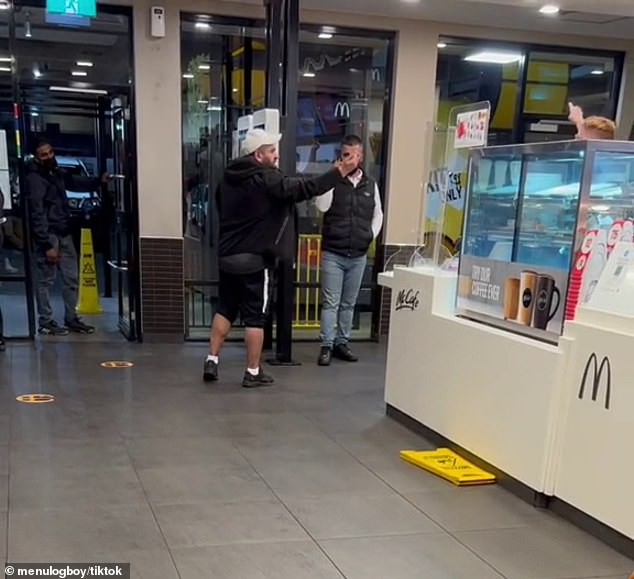
Locate an element on the screen. This screenshot has width=634, height=579. cups available for purchase is located at coordinates (537, 296), (527, 294), (510, 300).